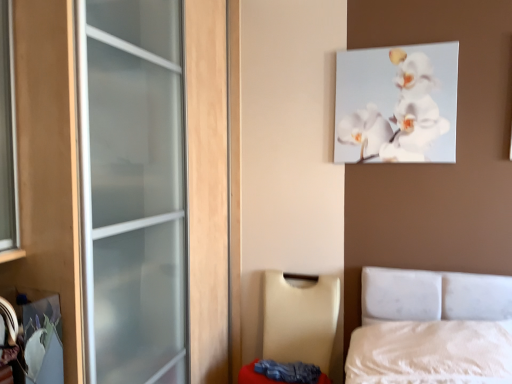
You are a GUI agent. You are given a task and a screenshot of the screen. Output one action in this format:
    pyautogui.click(x=<x>, y=<y>)
    Task: Click on the white fabric mattress at lower right
    This screenshot has height=384, width=512.
    Given the screenshot: What is the action you would take?
    pyautogui.click(x=254, y=375)

The image size is (512, 384). What are the coordinates of `white fabric mattress at lower right` in the screenshot? It's located at (254, 375).

Based on their positions, is beige leather chair at lower center located to the left or right of white glossy orchid at upper center?

beige leather chair at lower center is to the left of white glossy orchid at upper center.

Does beige leather chair at lower center have a larger size compared to white glossy orchid at upper center?

Correct, beige leather chair at lower center is larger in size than white glossy orchid at upper center.

Can you confirm if beige leather chair at lower center is shorter than white glossy orchid at upper center?

Incorrect, the height of beige leather chair at lower center does not fall short of that of white glossy orchid at upper center.

In terms of width, does beige leather chair at lower center look wider or thinner when compared to white glossy orchid at upper center?

In the image, beige leather chair at lower center appears to be wider than white glossy orchid at upper center.

Does white fabric mattress at lower right have a smaller size compared to beige leather chair at lower center?

Yes, white fabric mattress at lower right is smaller than beige leather chair at lower center.

Which is more to the right, white fabric mattress at lower right or beige leather chair at lower center?

From the viewer's perspective, white fabric mattress at lower right appears more on the right side.

Considering the positions of objects white fabric mattress at lower right and beige leather chair at lower center in the image provided, who is in front, white fabric mattress at lower right or beige leather chair at lower center?

beige leather chair at lower center is closer to the camera.

Would you consider white fabric mattress at lower right to be distant from beige leather chair at lower center?

No, white fabric mattress at lower right is not far away from beige leather chair at lower center.

Between white fabric mattress at lower right and white glossy orchid at upper center, which one has more height?

With more height is white glossy orchid at upper center.

Is white fabric mattress at lower right aimed at white glossy orchid at upper center?

No, white fabric mattress at lower right does not turn towards white glossy orchid at upper center.

From the image's perspective, which one is positioned higher, white fabric mattress at lower right or white glossy orchid at upper center?

white glossy orchid at upper center, from the image's perspective.

In the scene shown: Between white glossy orchid at upper center and white fabric mattress at lower right, which one has larger size?

white fabric mattress at lower right.

Could you tell me if white glossy orchid at upper center is facing white fabric mattress at lower right?

No, white glossy orchid at upper center is not aimed at white fabric mattress at lower right.

Is point (426, 146) closer or farther from the camera than point (240, 379)?

Point (426, 146).

Does point (391, 48) come behind point (290, 338)?

No.

How distant is white glossy orchid at upper center from beige leather chair at lower center?

The distance of white glossy orchid at upper center from beige leather chair at lower center is 35.45 inches.

Does white glossy orchid at upper center have a greater height compared to beige leather chair at lower center?

In fact, white glossy orchid at upper center may be shorter than beige leather chair at lower center.

This screenshot has height=384, width=512. I want to click on furniture located on the left of white glossy orchid at upper center, so click(x=300, y=319).

Is beige leather chair at lower center looking in the opposite direction of white fabric mattress at lower right?

Yes, beige leather chair at lower center is facing away from white fabric mattress at lower right.

Considering the points (264, 338) and (277, 381), which point is in front, point (264, 338) or point (277, 381)?

The point (277, 381) is in front.

Is beige leather chair at lower center situated inside white fabric mattress at lower right or outside?

The correct answer is: outside.

Visually, is beige leather chair at lower center positioned to the left or to the right of white fabric mattress at lower right?

Based on their positions, beige leather chair at lower center is located to the left of white fabric mattress at lower right.

The width and height of the screenshot is (512, 384). I want to click on furniture that is under the white glossy orchid at upper center (from a real-world perspective), so click(300, 319).

Locate an element on the screen. mattress below the beige leather chair at lower center (from the image's perspective) is located at coordinates (254, 375).

When comparing their distances from beige leather chair at lower center, does white fabric mattress at lower right or white glossy orchid at upper center seem closer?

white fabric mattress at lower right is closer to beige leather chair at lower center.

Considering their positions, is beige leather chair at lower center positioned further to white glossy orchid at upper center than white fabric mattress at lower right?

white fabric mattress at lower right is positioned further to the anchor white glossy orchid at upper center.

Looking at the image, which one is located closer to white fabric mattress at lower right, white glossy orchid at upper center or beige leather chair at lower center?

The object closer to white fabric mattress at lower right is beige leather chair at lower center.

When comparing their distances from beige leather chair at lower center, does white glossy orchid at upper center or white fabric mattress at lower right seem closer?

white fabric mattress at lower right is positioned closer to the anchor beige leather chair at lower center.

Which object lies nearer to the anchor point white glossy orchid at upper center, white fabric mattress at lower right or beige leather chair at lower center?

beige leather chair at lower center.

When comparing their distances from white fabric mattress at lower right, does beige leather chair at lower center or white glossy orchid at upper center seem closer?

The object closer to white fabric mattress at lower right is beige leather chair at lower center.

This screenshot has height=384, width=512. Identify the location of furniture that lies between white glossy orchid at upper center and white fabric mattress at lower right from top to bottom. (300, 319).